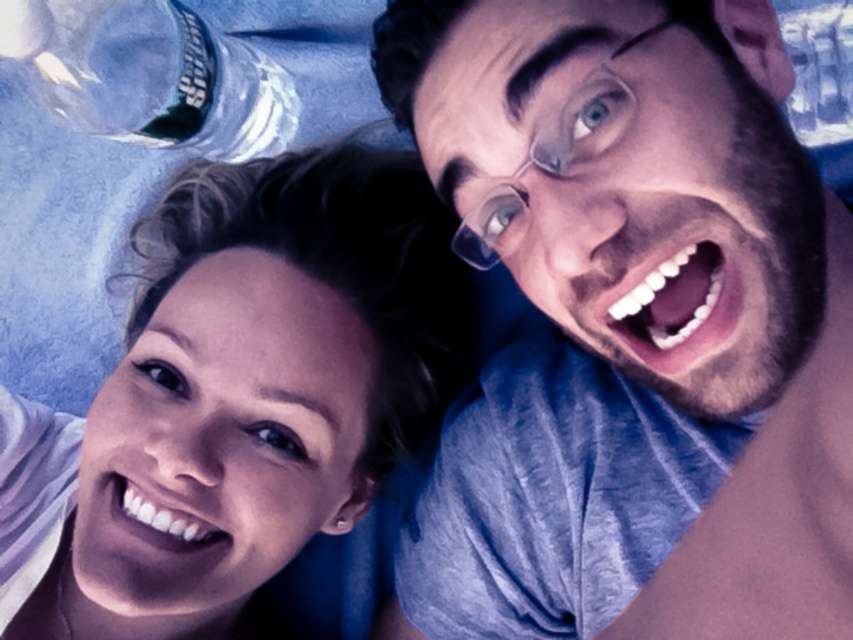
You are a photographer trying to capture a closeup shot of the person on the right. You notice two points marked in the scene at coordinates point (128, 390) and point (103, 48). Which point should you focus on to ensure the person on the right is in sharp focus?

You should focus on point (128, 390) because it is in front of point (103, 48), making it closer to the camera and thus better for focusing on the person on the right.

You are a photographer setting up a shot of two people lying down. You notice a clear plastic bottle at upper left in the frame. If you want to make sure the bottle is not too close to the camera, what is the minimum distance you should keep it at?

The clear plastic bottle at upper left is currently 35.19 inches away from the camera. To ensure it isn not too close, you should keep it at least 35.19 inches away.